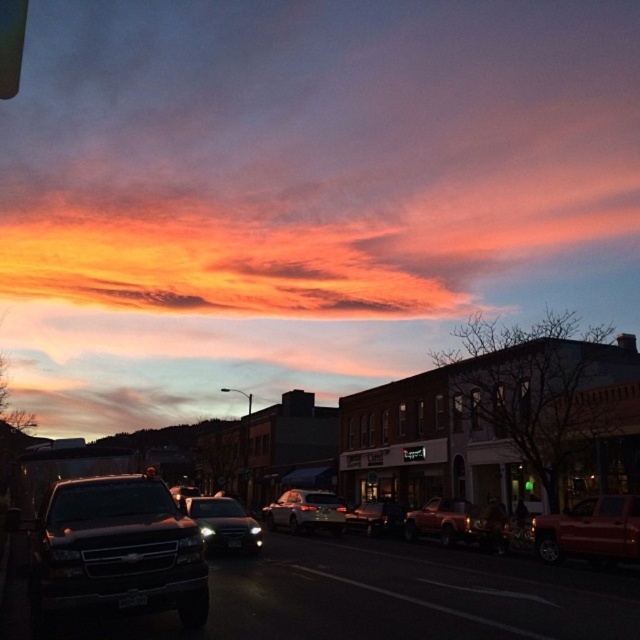
Question: Can you confirm if satin black sedan at center is positioned above shiny silver sedan at center?

Choices:
 (A) yes
 (B) no

Answer: (A)

Question: Does matte orange truck at center appear on the right side of satin black sedan at center?

Choices:
 (A) yes
 (B) no

Answer: (A)

Question: Which of the following is the closest to the observer?

Choices:
 (A) satin black sedan at center
 (B) matte orange sky at upper center

Answer: (A)

Question: Estimate the real-world distances between objects in this image. Which object is closer to the shiny silver sedan at center?

Choices:
 (A) matte orange sky at upper center
 (B) shiny black truck at lower left

Answer: (B)

Question: Which object is farther from the camera taking this photo?

Choices:
 (A) satin black sedan at center
 (B) satin silver sedan at center

Answer: (B)

Question: Is shiny black truck at lower left positioned at the back of shiny red car at right?

Choices:
 (A) no
 (B) yes

Answer: (A)